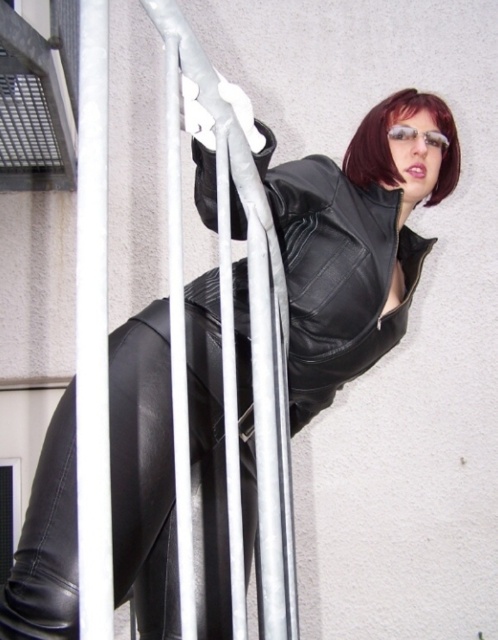
Based on the photo, you are a photographer trying to capture the climber in the scene. You notice the silver metallic pole at left and the dark red hair at upper center. Which object would appear thinner in your photo?

The silver metallic pole at left is thinner than the dark red hair at upper center, so it would appear thinner in the photo.

You are a photographer trying to capture the black leather jacket at center and the silver metallic pole at left in a single frame. Which object should you focus on first if you want to ensure both are in focus without adjusting your camera settings?

The black leather jacket at center is larger in size than the silver metallic pole at left, so focusing on the larger object first will help ensure both are in focus without needing to adjust the camera settings.

You are standing at the base of the staircase in the image and want to reach the top. There are two points marked on the staircase. Which point is closer to you, point (334, 308) or point (108, 438)?

Point (334, 308) is further to the viewer than point (108, 438), so the point closer to you is point (108, 438).